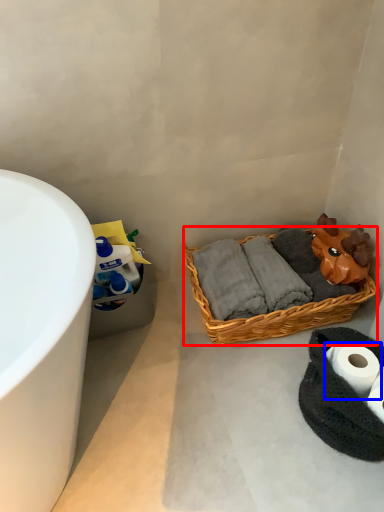
Question: Which object is further to the camera taking this photo, picnic basket (highlighted by a red box) or toilet paper (highlighted by a blue box)?

Choices:
 (A) picnic basket
 (B) toilet paper

Answer: (A)